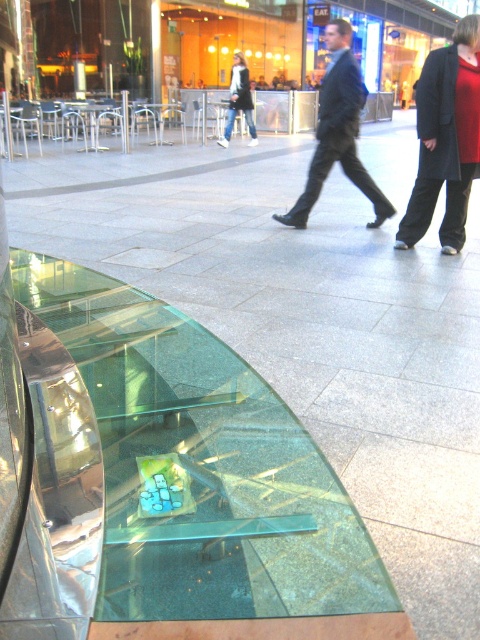
Question: Is transparent glass table at lower left smaller than white fabric jacket at center?

Choices:
 (A) no
 (B) yes

Answer: (A)

Question: Estimate the real-world distances between objects in this image. Which object is farther from the dark blue suit at center?

Choices:
 (A) white fabric jacket at center
 (B) transparent glass table at lower left
 (C) red woolen sweater at upper right

Answer: (A)

Question: Observing the image, what is the correct spatial positioning of transparent glass table at lower left in reference to white fabric jacket at center?

Choices:
 (A) above
 (B) below

Answer: (B)

Question: Which of the following is the farthest from the observer?

Choices:
 (A) (467, 180)
 (B) (236, 113)
 (C) (136, 515)

Answer: (B)

Question: Does transparent glass table at lower left have a lesser width compared to white fabric jacket at center?

Choices:
 (A) no
 (B) yes

Answer: (A)

Question: Among these points, which one is farthest from the camera?

Choices:
 (A) (467, 97)
 (B) (238, 81)

Answer: (B)